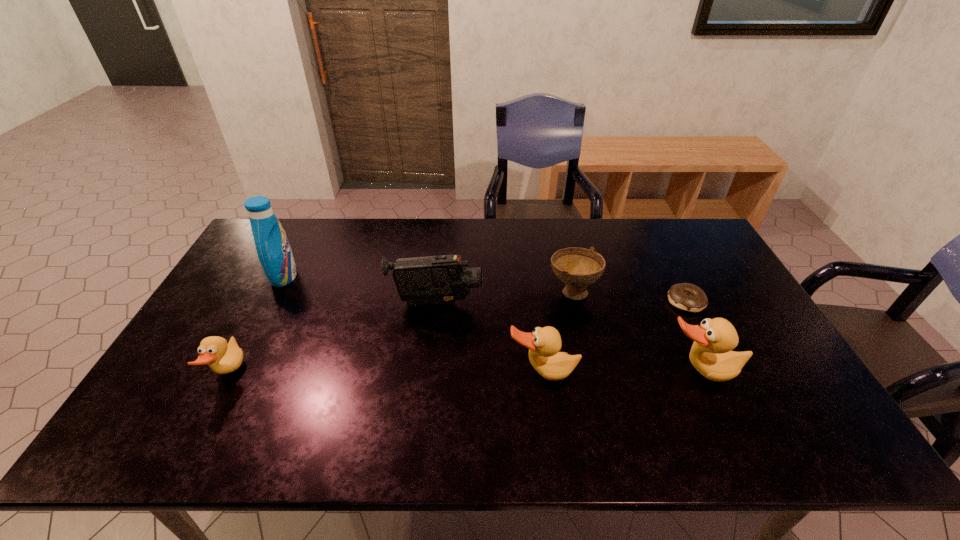
The image size is (960, 540). Find the location of `vacant spot for a new duck to ensure equal spacing`. vacant spot for a new duck to ensure equal spacing is located at coordinates (386, 373).